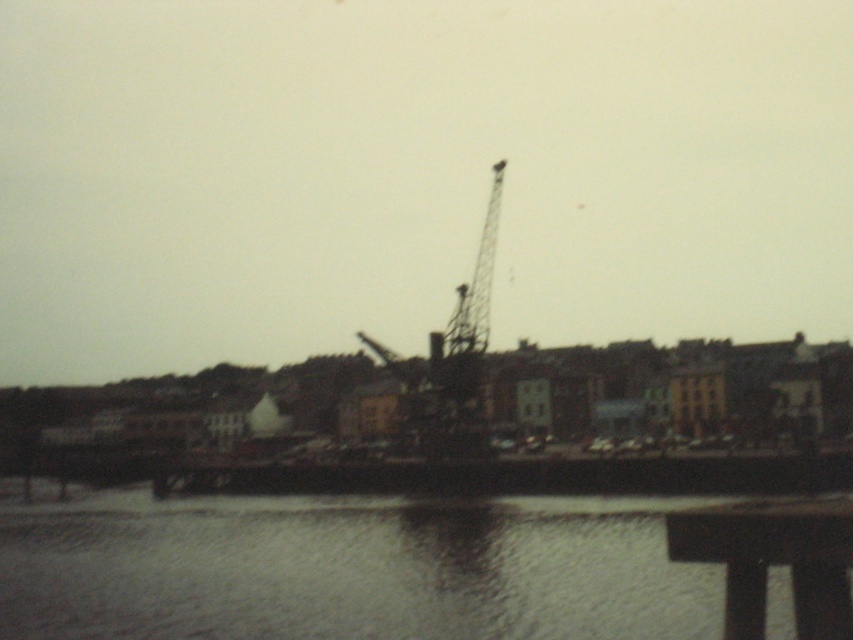
Between smooth water at lower center and metallic tower crane at center, which one is positioned higher?

Positioned higher is metallic tower crane at center.

Who is more forward, (587,556) or (485,240)?

Point (587,556) is in front.

The image size is (853, 640). In order to click on smooth water at lower center in this screenshot , I will do `click(351, 570)`.

Between smooth dark wood dock at lower right and metallic tower crane at center, which one is positioned lower?

smooth dark wood dock at lower right

Does smooth dark wood dock at lower right appear over metallic tower crane at center?

No.

Is point (830, 570) positioned before point (473, 292)?

Yes, point (830, 570) is closer to viewer.

The width and height of the screenshot is (853, 640). I want to click on smooth dark wood dock at lower right, so click(773, 560).

Can you confirm if smooth water at lower center is bigger than smooth dark wood dock at lower right?

Indeed, smooth water at lower center has a larger size compared to smooth dark wood dock at lower right.

Which is in front, point (151, 602) or point (689, 545)?

Point (689, 545) is in front.

Does point (218, 627) come in front of point (844, 512)?

No, (218, 627) is behind (844, 512).

You are a GUI agent. You are given a task and a screenshot of the screen. Output one action in this format:
    pyautogui.click(x=<x>, y=<y>)
    Task: Click on the smooth water at lower center
    Image resolution: width=853 pixels, height=640 pixels.
    Given the screenshot: What is the action you would take?
    pyautogui.click(x=351, y=570)